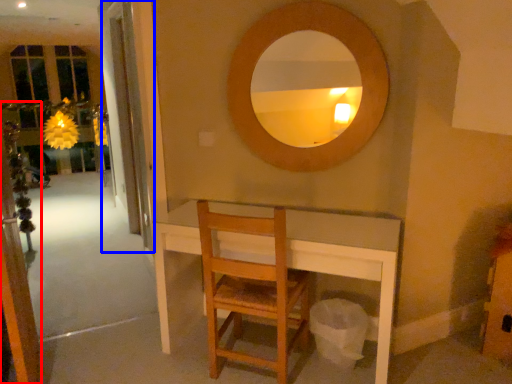
Question: Which object appears farthest to the camera in this image, screen door (highlighted by a red box) or screen door (highlighted by a blue box)?

Choices:
 (A) screen door
 (B) screen door

Answer: (B)